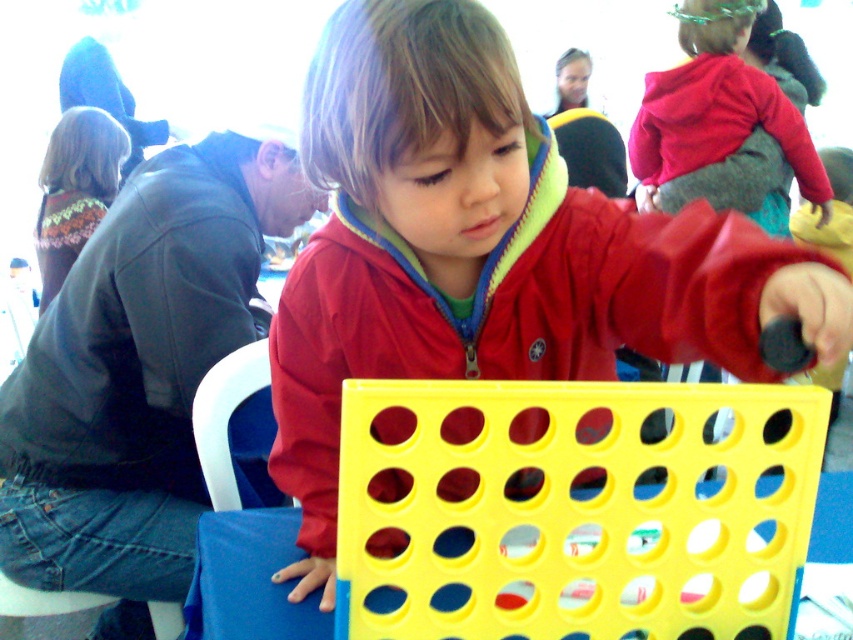
Question: Is the position of matte plastic child at center more distant than that of yellow plastic table at center?

Choices:
 (A) yes
 (B) no

Answer: (B)

Question: Can you confirm if matte plastic child at center is bigger than yellow plastic table at center?

Choices:
 (A) no
 (B) yes

Answer: (B)

Question: Which point is closer to the camera?

Choices:
 (A) matte plastic child at center
 (B) yellow plastic table at center

Answer: (A)

Question: Which of the following is the farthest from the observer?

Choices:
 (A) (236, 637)
 (B) (805, 316)

Answer: (A)

Question: Is matte plastic child at center positioned behind yellow plastic table at center?

Choices:
 (A) yes
 (B) no

Answer: (B)